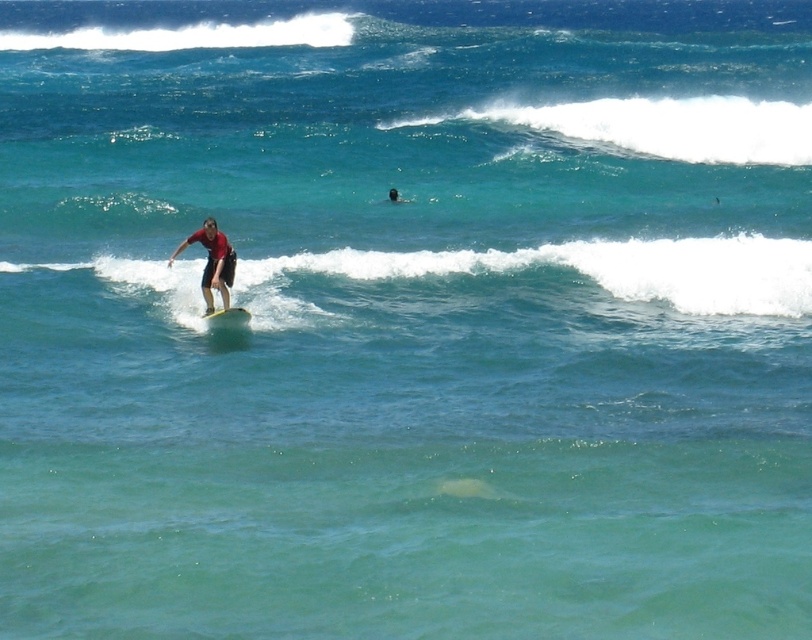
Question: Which of these objects is positioned farthest from the white foamy wave at center?

Choices:
 (A) white foam surfboard at center
 (B) matte red shirt at center

Answer: (A)

Question: Estimate the real-world distances between objects in this image. Which object is farther from the white foam surfboard at center?

Choices:
 (A) matte red shirt at center
 (B) white foamy wave at center

Answer: (B)

Question: Which object is positioned farthest from the matte red shirt at center?

Choices:
 (A) white foam surfboard at center
 (B) white foamy wave at center

Answer: (B)

Question: Can you confirm if white foamy wave at center is positioned to the left of matte red shirt at center?

Choices:
 (A) yes
 (B) no

Answer: (B)

Question: Is white foamy wave at center thinner than matte red shirt at center?

Choices:
 (A) no
 (B) yes

Answer: (A)

Question: Is matte red shirt at center further to camera compared to white foam surfboard at center?

Choices:
 (A) no
 (B) yes

Answer: (B)